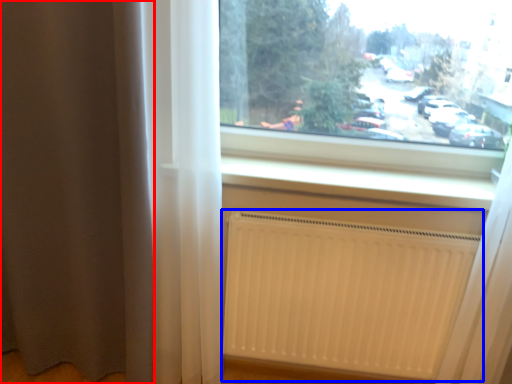
Question: Which of the following is the closest to the observer, curtain (highlighted by a red box) or radiator (highlighted by a blue box)?

Choices:
 (A) curtain
 (B) radiator

Answer: (A)